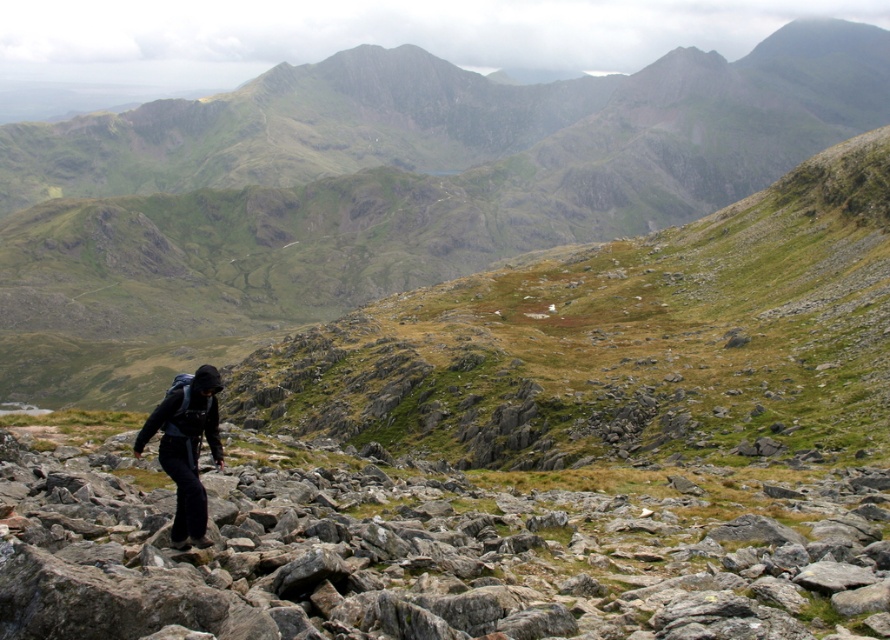
Question: Does green grassy hillside at center come in front of dark gray backpack at center?

Choices:
 (A) no
 (B) yes

Answer: (A)

Question: Estimate the real-world distances between objects in this image. Which object is farther from the dark gray backpack at center?

Choices:
 (A) green grassy hillside at center
 (B) gray rough rock at center

Answer: (A)

Question: Which point is closer to the camera taking this photo?

Choices:
 (A) (822, 531)
 (B) (182, 465)
 (C) (30, 216)

Answer: (B)

Question: Does green grassy hillside at center appear on the right side of gray rough rock at center?

Choices:
 (A) no
 (B) yes

Answer: (A)

Question: Which object is the farthest from the dark gray backpack at center?

Choices:
 (A) gray rough rock at center
 (B) green grassy hillside at center

Answer: (B)

Question: Does green grassy hillside at center appear under dark gray backpack at center?

Choices:
 (A) no
 (B) yes

Answer: (A)